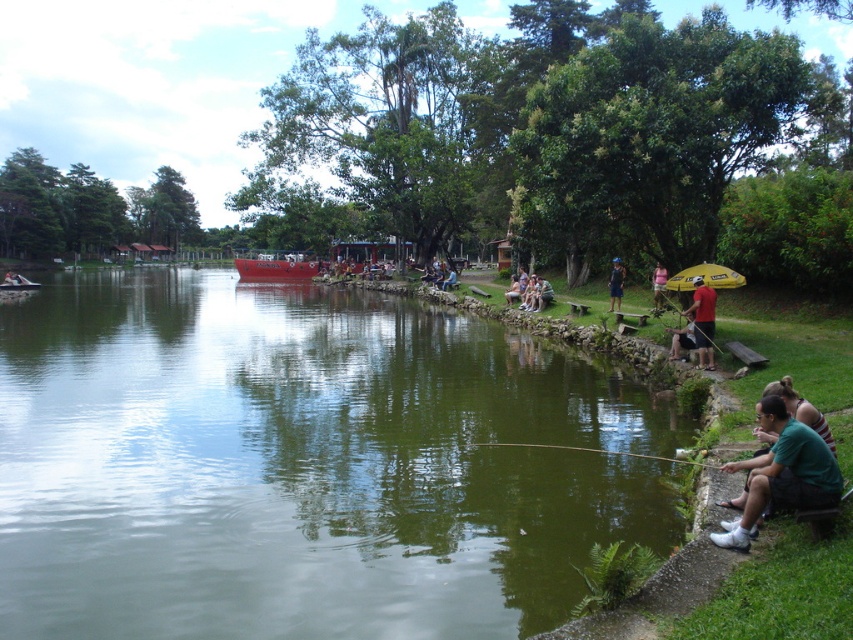
Does red matte shirt at right have a lesser width compared to blue fabric shirt at center-right?

Indeed, red matte shirt at right has a lesser width compared to blue fabric shirt at center-right.

Which is more to the left, red matte shirt at right or blue fabric shirt at center-right?

red matte shirt at right

You are a GUI agent. You are given a task and a screenshot of the screen. Output one action in this format:
    pyautogui.click(x=<x>, y=<y>)
    Task: Click on the red matte shirt at right
    This screenshot has height=640, width=853.
    Given the screenshot: What is the action you would take?
    pyautogui.click(x=701, y=321)

The width and height of the screenshot is (853, 640). Identify the location of red matte shirt at right. (701, 321).

From the picture: Which of these two, wooden fishing pole at lower center or blue fabric shirt at center-right, stands shorter?

With less height is wooden fishing pole at lower center.

Looking at this image, is wooden fishing pole at lower center to the left of blue fabric shirt at center-right from the viewer's perspective?

Correct, you'll find wooden fishing pole at lower center to the left of blue fabric shirt at center-right.

Does point (547, 448) come farther from viewer compared to point (618, 280)?

That is False.

This screenshot has width=853, height=640. In order to click on wooden fishing pole at lower center in this screenshot , I will do `click(596, 451)`.

Can you confirm if wooden fishing pole at lower center is positioned to the right of pink fabric shirt at right?

No, wooden fishing pole at lower center is not to the right of pink fabric shirt at right.

Who is lower down, wooden fishing pole at lower center or pink fabric shirt at right?

Positioned lower is wooden fishing pole at lower center.

What do you see at coordinates (596, 451) in the screenshot? I see `wooden fishing pole at lower center` at bounding box center [596, 451].

You are a GUI agent. You are given a task and a screenshot of the screen. Output one action in this format:
    pyautogui.click(x=<x>, y=<y>)
    Task: Click on the wooden fishing pole at lower center
    
    Given the screenshot: What is the action you would take?
    pyautogui.click(x=596, y=451)